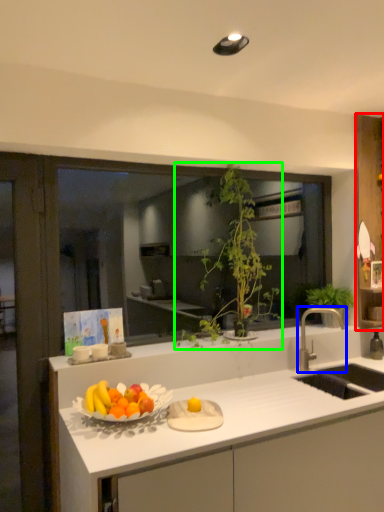
Question: Which object is the closest to the cabinetry (highlighted by a red box)? Choose among these: tap (highlighted by a blue box) or houseplant (highlighted by a green box).

Choices:
 (A) tap
 (B) houseplant

Answer: (A)